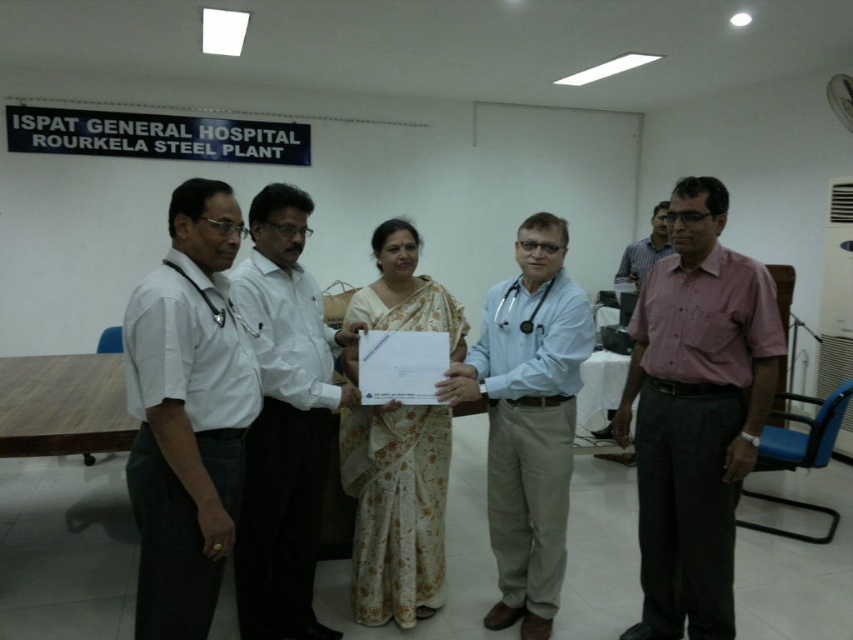
Is pink cotton shirt at center thinner than light blue shirt at center?

Yes, pink cotton shirt at center is thinner than light blue shirt at center.

What are the coordinates of `pink cotton shirt at center` in the screenshot? It's located at (695, 412).

The image size is (853, 640). Identify the location of pink cotton shirt at center. (695, 412).

Is light blue shirt at center taller than white floral saree at center?

Yes, light blue shirt at center is taller than white floral saree at center.

Does point (529, 516) come closer to viewer compared to point (367, 451)?

No.

What do you see at coordinates (527, 419) in the screenshot?
I see `light blue shirt at center` at bounding box center [527, 419].

Find the location of a particular element. This screenshot has height=640, width=853. light blue shirt at center is located at coordinates (527, 419).

Is white shirt at left positioned at the back of light blue shirt at center?

No, it is not.

Can you confirm if white shirt at left is positioned above light blue shirt at center?

Yes.

Find the location of `white shirt at left`. white shirt at left is located at coordinates (187, 413).

Image resolution: width=853 pixels, height=640 pixels. I want to click on white shirt at left, so click(x=187, y=413).